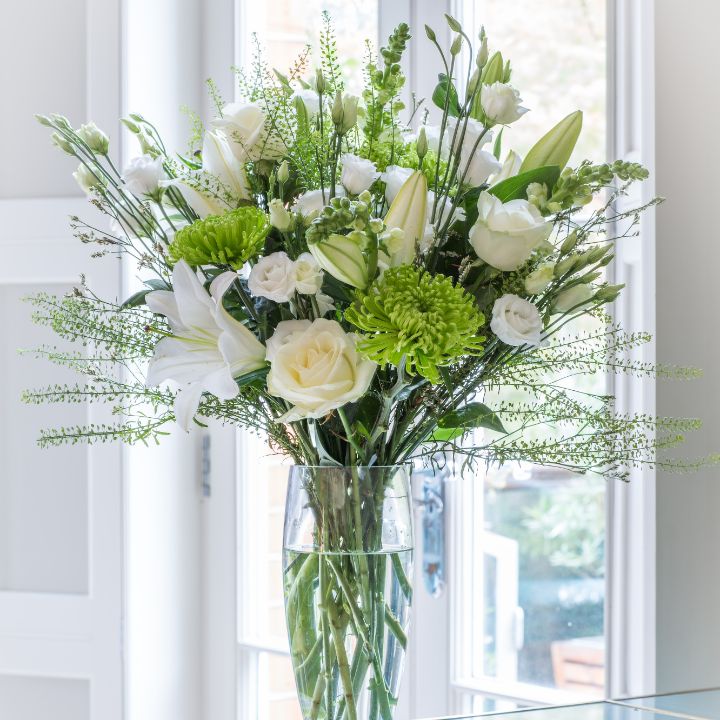
This screenshot has height=720, width=720. Identify the location of panes of glass. (482, 703), (531, 631), (266, 580), (274, 685), (582, 714), (647, 702).